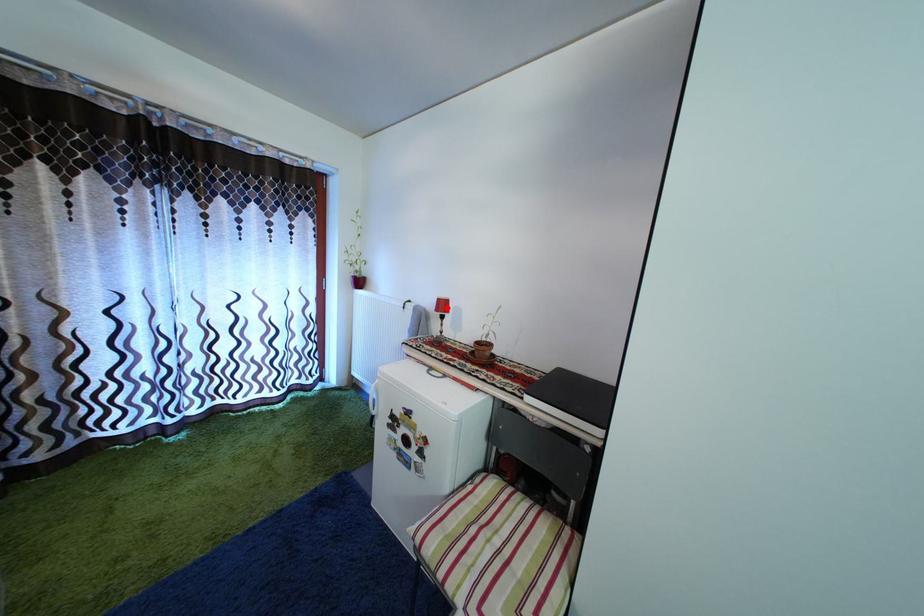
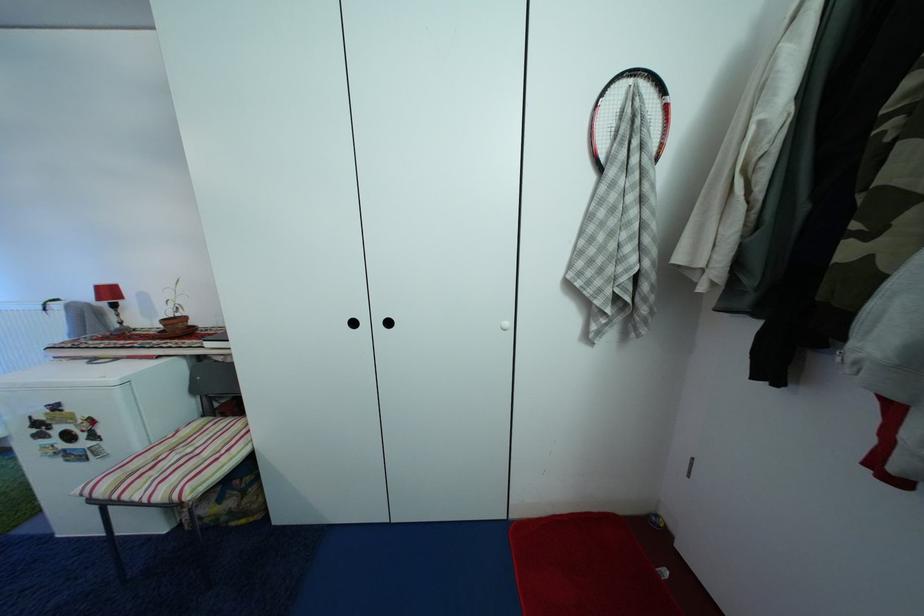
In the second image, find the point that corresponds to the highlighted location in the first image.

(106, 294)